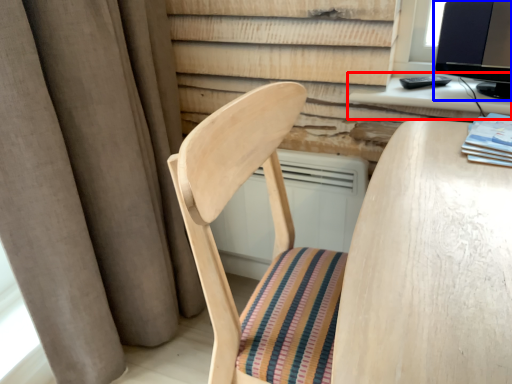
Question: Which point is further to the camera, computer desk (highlighted by a red box) or computer monitor (highlighted by a blue box)?

Choices:
 (A) computer desk
 (B) computer monitor

Answer: (A)